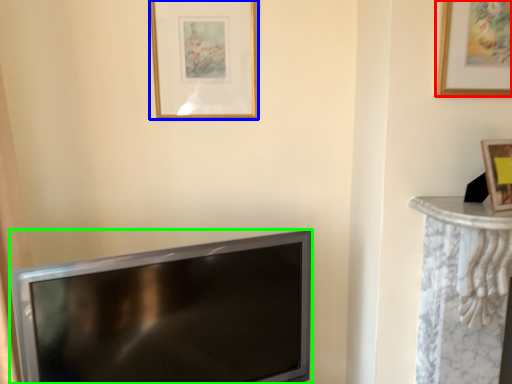
Question: Which object is the farthest from picture frame (highlighted by a red box)? Choose among these: picture frame (highlighted by a blue box) or television (highlighted by a green box).

Choices:
 (A) picture frame
 (B) television

Answer: (B)